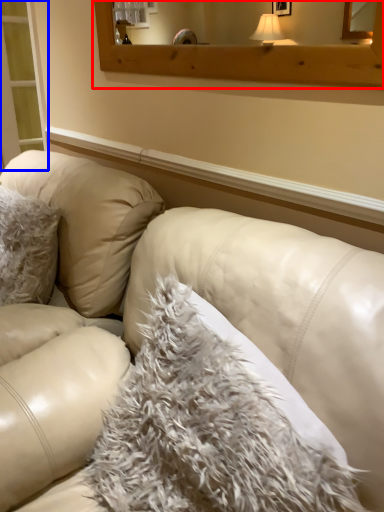
Question: Among these objects, which one is farthest to the camera, window frame (highlighted by a red box) or screen door (highlighted by a blue box)?

Choices:
 (A) window frame
 (B) screen door

Answer: (B)